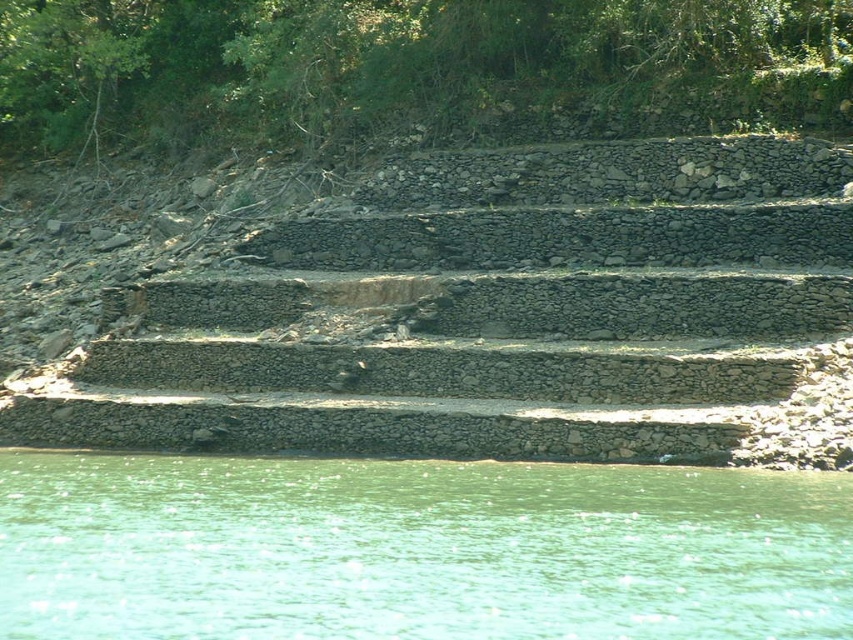
You are standing on the gray stone stairs at center and want to reach the green water at lower center. In which direction should you move?

You should move to the right because the gray stone stairs at center are to the left of green water at lower center.

From the picture: You are standing on the gray stone stairs at center and want to reach the green water at lower center. Which direction should you move to get there?

You should move downward from the gray stone stairs at center to reach the green water at lower center since the stairs are located above the water.